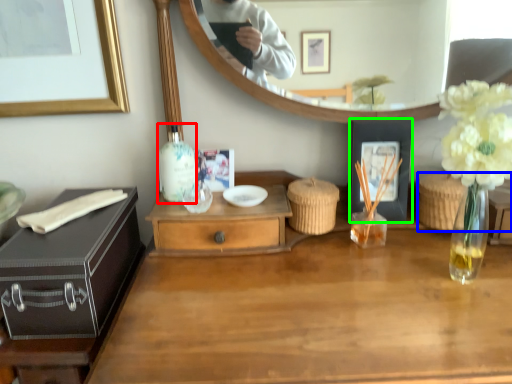
Question: Based on their relative distances, which object is nearer to bottle (highlighted by a red box)? Choose from picnic basket (highlighted by a blue box) and picture frame (highlighted by a green box).

Choices:
 (A) picnic basket
 (B) picture frame

Answer: (B)